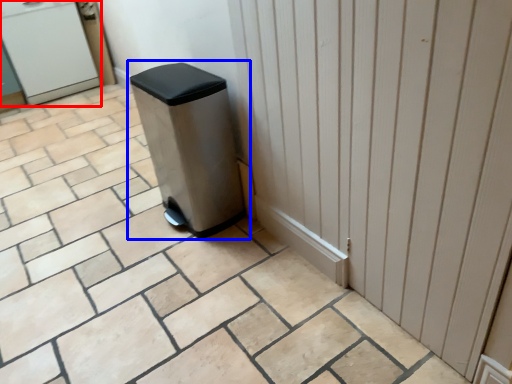
Question: Which object is further to the camera taking this photo, water cooler (highlighted by a red box) or waste container (highlighted by a blue box)?

Choices:
 (A) water cooler
 (B) waste container

Answer: (A)